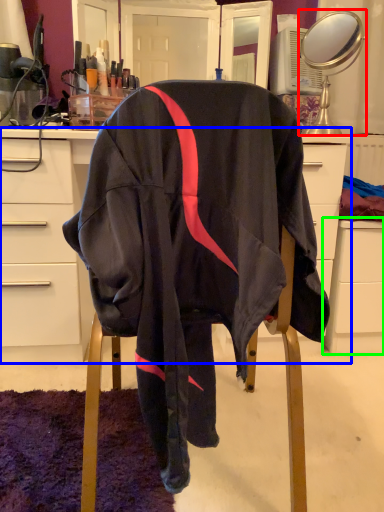
Question: Estimate the real-world distances between objects in this image. Which object is farther from mirror (highlighted by a red box), desk (highlighted by a blue box) or file cabinet (highlighted by a green box)?

Choices:
 (A) desk
 (B) file cabinet

Answer: (A)